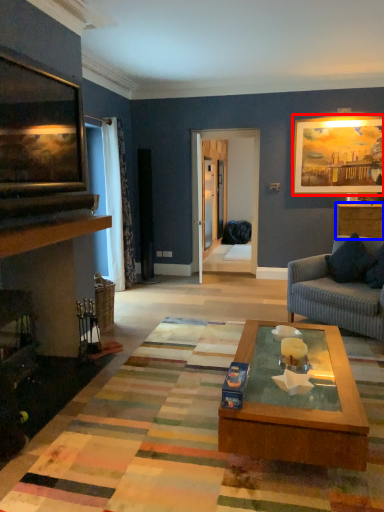
Question: Which of the following is the closest to the observer, picture frame (highlighted by a red box) or cabinetry (highlighted by a blue box)?

Choices:
 (A) picture frame
 (B) cabinetry

Answer: (B)